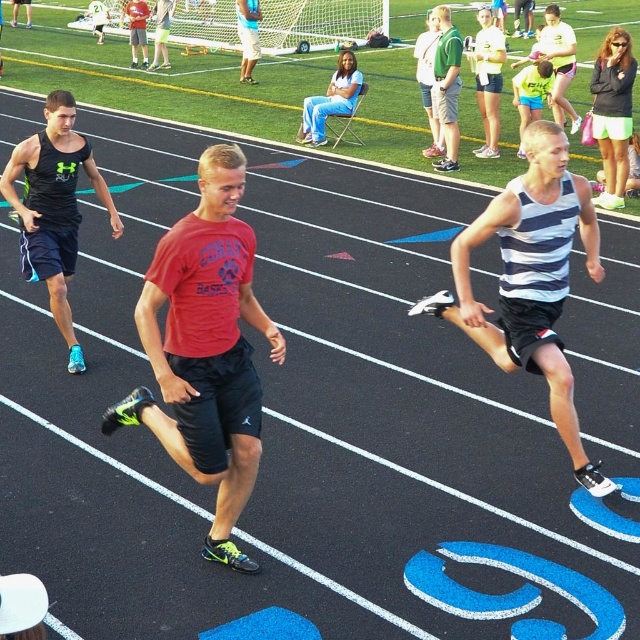
You are a photographer at the track and field event. You want to capture a photo that includes both the matte black tank top at left and the blue jeans at center. Based on their positions, which one should you focus on first to ensure both are in the frame?

The matte black tank top at left is in front of the blue jeans at center, so you should focus on the blue jeans at center first to ensure both are in the frame.